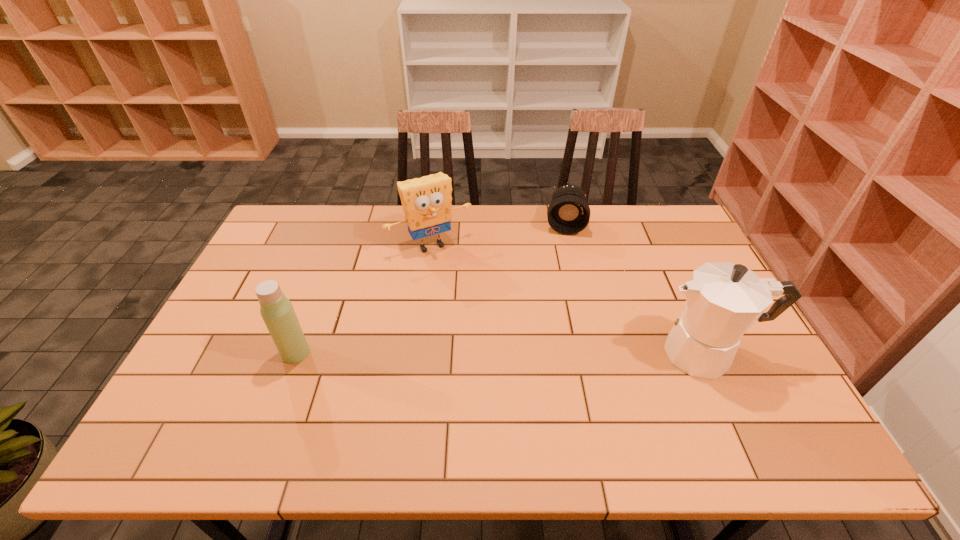
At what (x,y) coordinates should I click in order to perform the action: click on unoccupied area between the second object from left to right and the leftmost object. Please return your answer as a coordinate pair (x, y). The width and height of the screenshot is (960, 540). Looking at the image, I should click on pyautogui.click(x=364, y=299).

I want to click on vacant area that lies between the thermos bottle and the rightmost object, so click(501, 353).

Locate an element on the screen. This screenshot has height=540, width=960. free space between the telephoto lens and the tallest object is located at coordinates click(x=636, y=289).

Locate an element on the screen. This screenshot has width=960, height=540. the closest object to the thermos bottle is located at coordinates (426, 201).

Identify which object is the third nearest to the sponge. Please provide its 2D coordinates. Your answer should be formatted as a tuple, i.e. [(x, y)], where the tuple contains the x and y coordinates of a point satisfying the conditions above.

[(723, 300)]

This screenshot has height=540, width=960. In order to click on vacant region that satisfies the following two spatial constraints: 1. on the back side of the leftmost object; 2. on the right side of the shortest object in this screenshot , I will do `click(345, 225)`.